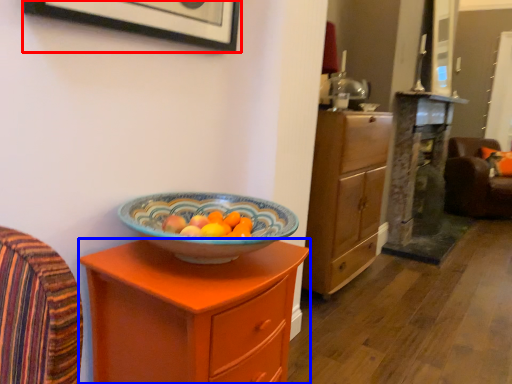
Question: Which object is further to the camera taking this photo, picture frame (highlighted by a red box) or chest of drawers (highlighted by a blue box)?

Choices:
 (A) picture frame
 (B) chest of drawers

Answer: (B)